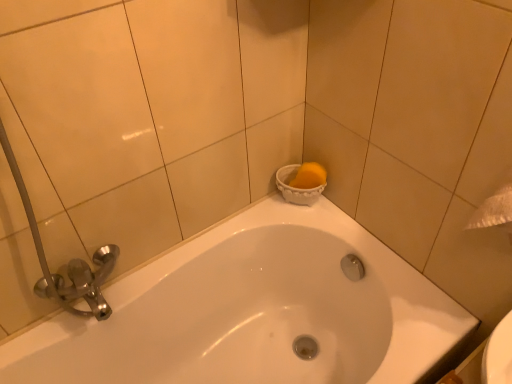
Question: From a real-world perspective, is white glossy bathtub at upper center above or below yellow sponge at upper right?

Choices:
 (A) below
 (B) above

Answer: (A)

Question: From the image's perspective, relative to yellow sponge at upper right, is white glossy bathtub at upper center above or below?

Choices:
 (A) above
 (B) below

Answer: (B)

Question: Do you think white glossy bathtub at upper center is within yellow sponge at upper right, or outside of it?

Choices:
 (A) inside
 (B) outside

Answer: (B)

Question: Based on their sizes in the image, would you say yellow sponge at upper right is bigger or smaller than white glossy bathtub at upper center?

Choices:
 (A) small
 (B) big

Answer: (A)

Question: Considering the positions of point (309, 203) and point (270, 223), is point (309, 203) closer or farther from the camera than point (270, 223)?

Choices:
 (A) farther
 (B) closer

Answer: (B)

Question: In terms of width, does yellow sponge at upper right look wider or thinner when compared to white glossy bathtub at upper center?

Choices:
 (A) wide
 (B) thin

Answer: (B)

Question: Would you say yellow sponge at upper right is to the left or to the right of white glossy bathtub at upper center in the picture?

Choices:
 (A) right
 (B) left

Answer: (A)